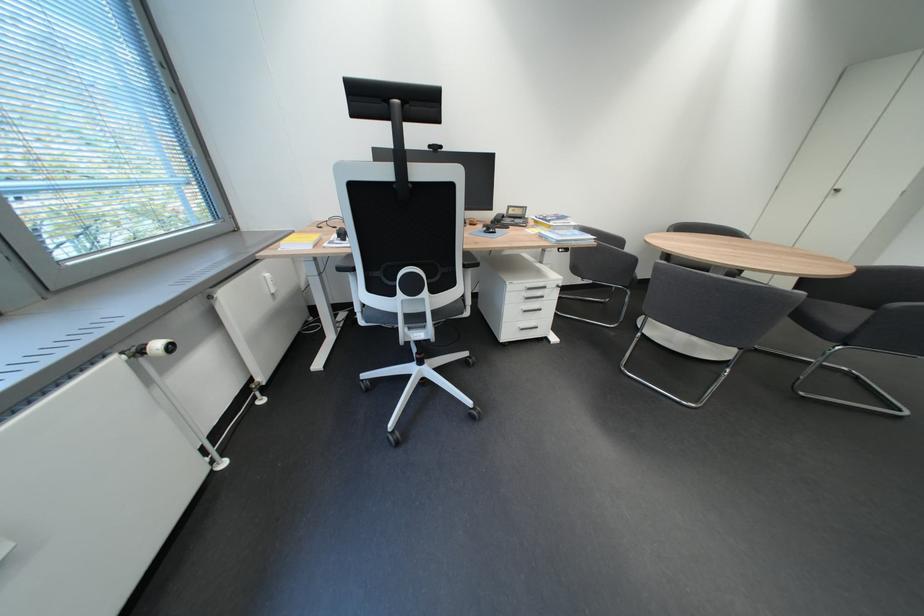
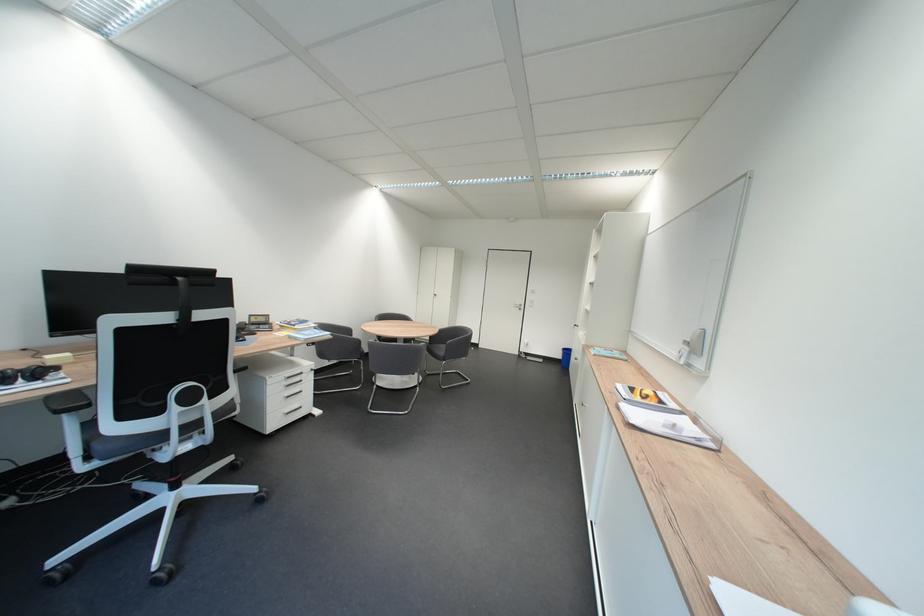
Where in the second image is the point corresponding to (541,291) from the first image?

(300, 379)